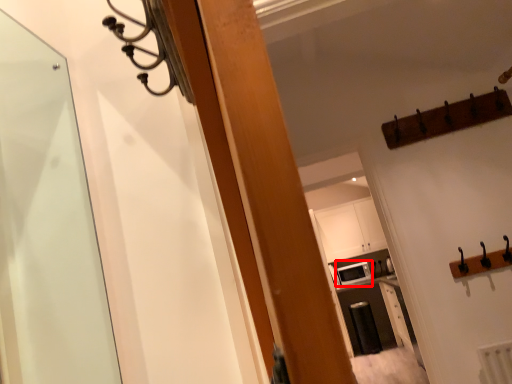
Question: In this image, where is appliance (annotated by the red box) located relative to cabinetry?

Choices:
 (A) left
 (B) right

Answer: (B)